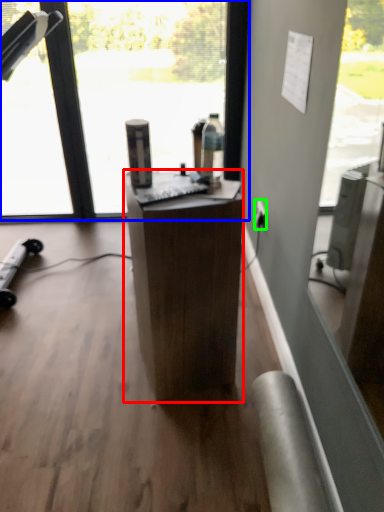
Question: Which is farther away from desk (highlighted by a red box)? window (highlighted by a blue box) or power outlet (highlighted by a green box)?

Choices:
 (A) window
 (B) power outlet

Answer: (A)